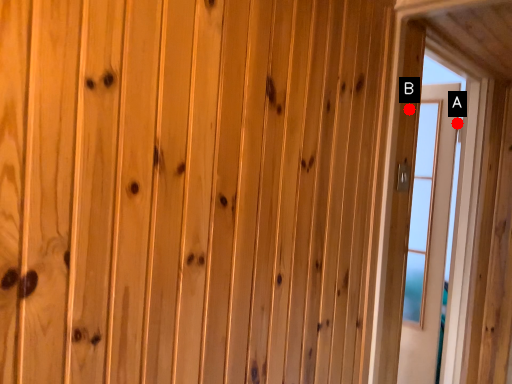
Question: Two points are circled on the image, labeled by A and B beside each circle. Which point is farther from the camera taking this photo?

Choices:
 (A) A is further
 (B) B is further

Answer: (A)